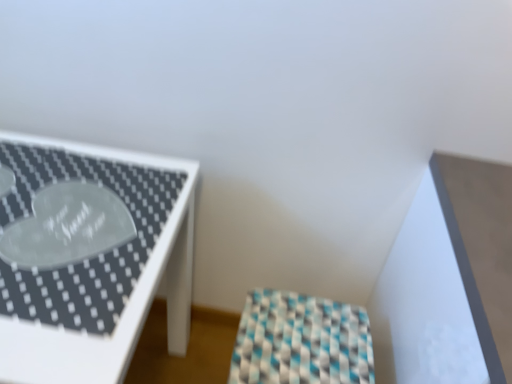
The image size is (512, 384). I want to click on free spot above checkered fabric stool at center, which is the 1th furniture in right-to-left order (from a real-world perspective), so click(x=306, y=339).